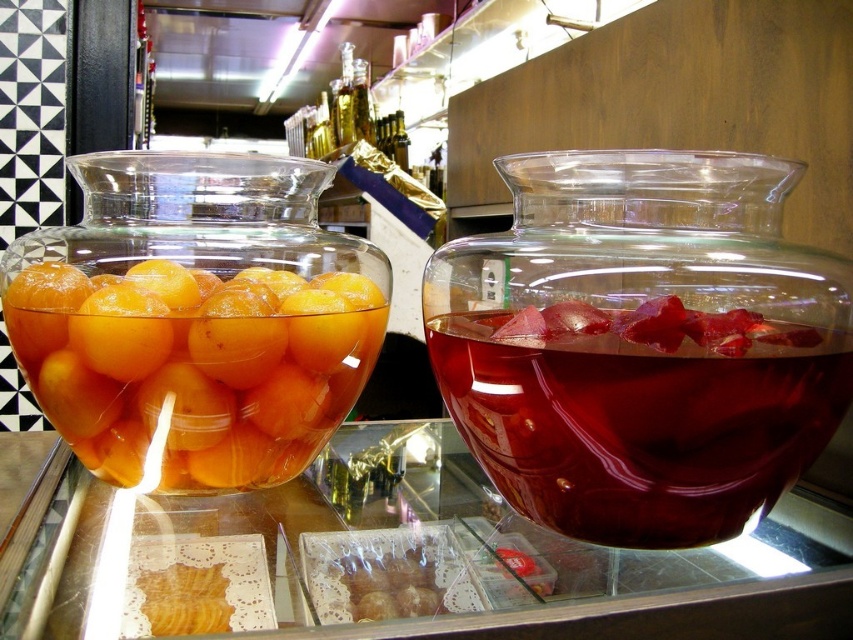
Is matte yellow orange at left taller than matte yellow orange at center?

No.

Can you confirm if matte yellow orange at left is positioned above matte yellow orange at center?

Yes.

Which is behind, point (79, 348) or point (244, 364)?

The point (244, 364) is behind.

Identify the location of matte yellow orange at left. This screenshot has width=853, height=640. (120, 332).

Can you confirm if transparent glass table at center is wider than matte yellow orange at center?

Indeed, transparent glass table at center has a greater width compared to matte yellow orange at center.

Is transparent glass table at center further to camera compared to matte yellow orange at center?

That is False.

Between point (595, 621) and point (242, 300), which one is positioned behind?

Positioned behind is point (242, 300).

Locate an element on the screen. The image size is (853, 640). transparent glass table at center is located at coordinates (474, 560).

Can you confirm if transparent glass jar at right is bigger than yellow translucent fruit at left?

Yes.

Where is `transparent glass jar at right`? This screenshot has height=640, width=853. transparent glass jar at right is located at coordinates (641, 342).